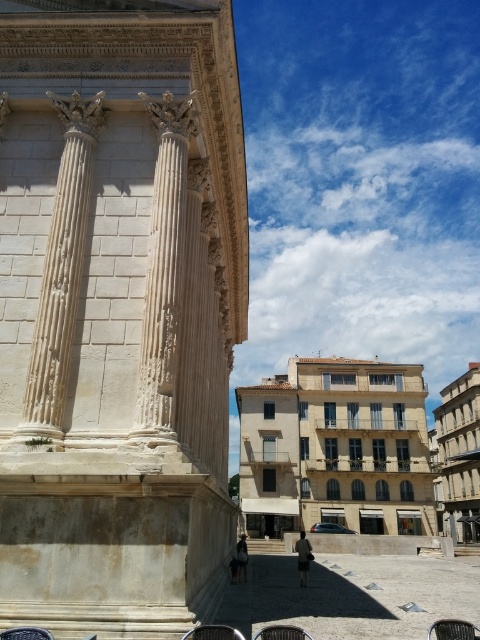
Between metallic mesh chair at lower center and brown woven chair at lower left, which one is positioned lower?

metallic mesh chair at lower center is below.

Can you confirm if metallic mesh chair at lower center is positioned below brown woven chair at lower left?

Yes, metallic mesh chair at lower center is below brown woven chair at lower left.

Between point (289, 634) and point (32, 630), which one is positioned in front?

Point (32, 630) is more forward.

Where is `metallic mesh chair at lower center`? Image resolution: width=480 pixels, height=640 pixels. metallic mesh chair at lower center is located at coordinates (282, 632).

Looking at this image, does white marble column at left appear on the right side of metallic black chair at lower center?

No, white marble column at left is not to the right of metallic black chair at lower center.

Does white marble column at left have a greater width compared to metallic black chair at lower center?

Yes.

What do you see at coordinates (60, 273) in the screenshot?
I see `white marble column at left` at bounding box center [60, 273].

Locate an element on the screen. The image size is (480, 640). white marble column at left is located at coordinates tap(60, 273).

Who is taller, white marble column at left or metallic mesh chair at lower center?

white marble column at left is taller.

Between point (43, 333) and point (297, 632), which one is positioned in front?

Point (297, 632) is more forward.

Between point (71, 259) and point (279, 628), which one is positioned behind?

Positioned behind is point (71, 259).

In order to click on white marble column at left in this screenshot , I will do coord(60,273).